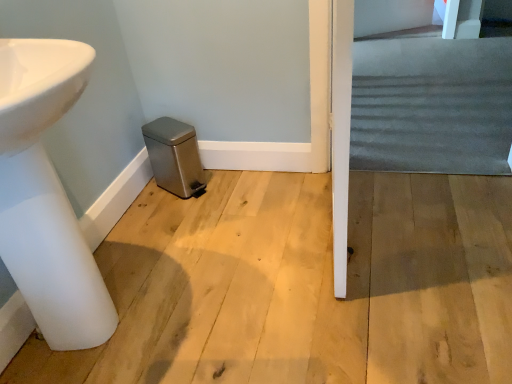
Where is `vacant region under white glossy sink at lower left (from a real-world perspective)`? This screenshot has height=384, width=512. vacant region under white glossy sink at lower left (from a real-world perspective) is located at coordinates (109, 333).